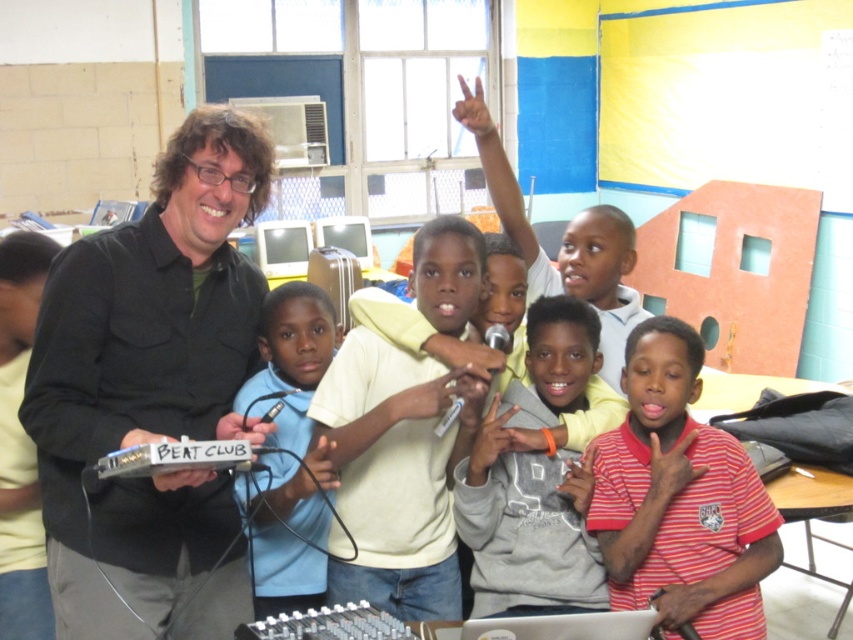
Between gray fleece hoodie at center and blue fabric shirt at center, which one has less height?

Standing shorter between the two is gray fleece hoodie at center.

Between gray fleece hoodie at center and blue fabric shirt at center, which one is positioned lower?

Result: gray fleece hoodie at center is lower down.

Measure the distance between point [549,324] and camera.

Point [549,324] and camera are 2.12 meters apart from each other.

This screenshot has width=853, height=640. Identify the location of gray fleece hoodie at center. (534, 477).

Does black matte shirt at center have a lesser width compared to light yellow hoodie at center?

No, black matte shirt at center is not thinner than light yellow hoodie at center.

Which is above, black matte shirt at center or light yellow hoodie at center?

Positioned higher is black matte shirt at center.

Image resolution: width=853 pixels, height=640 pixels. Identify the location of black matte shirt at center. (152, 390).

From the picture: Which is below, light yellow hoodie at center or striped cotton shirt at center?

striped cotton shirt at center is below.

Who is more distant from viewer, (x=426, y=492) or (x=764, y=560)?

Positioned behind is point (x=426, y=492).

Who is more forward, [476,401] or [693,552]?

Point [476,401] is in front.

The width and height of the screenshot is (853, 640). I want to click on light yellow hoodie at center, so (395, 474).